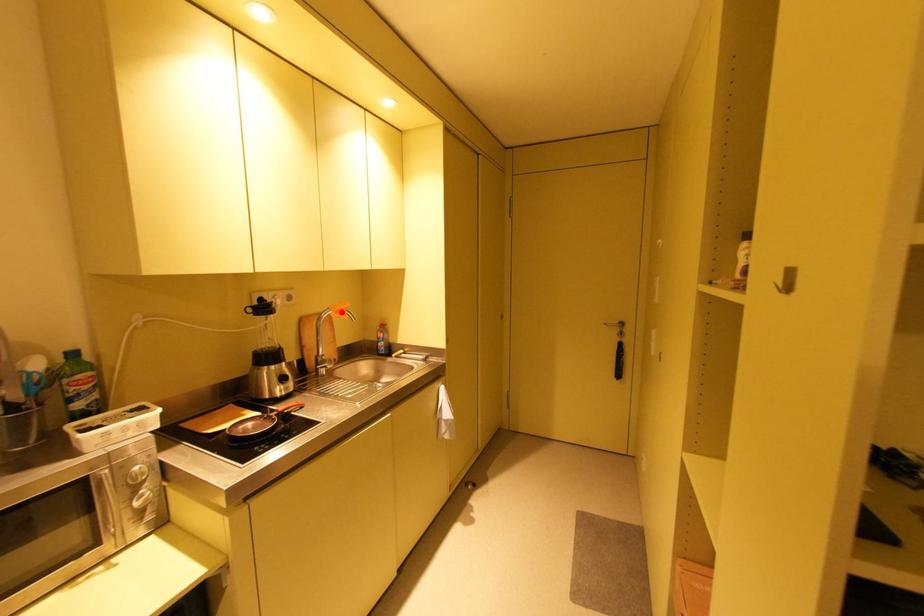
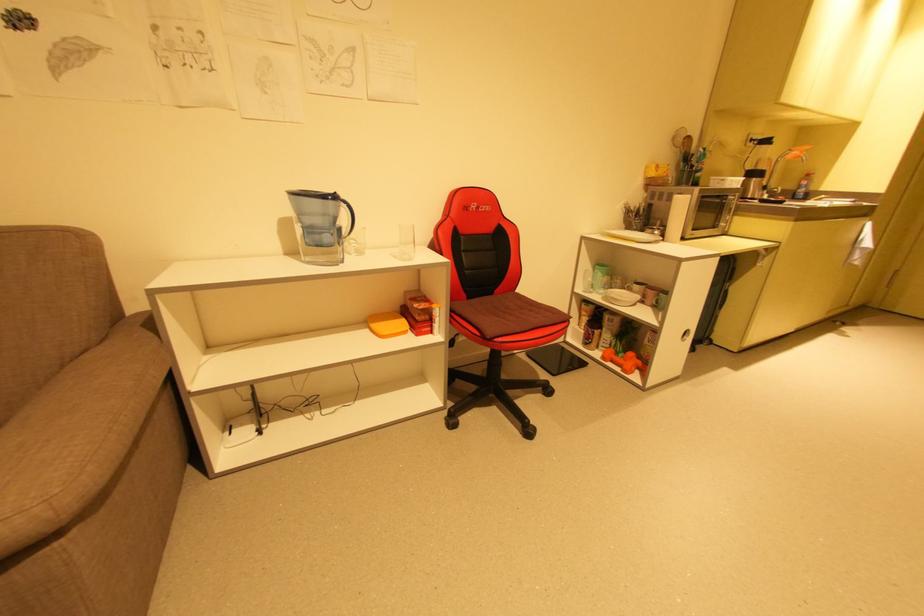
Question: I am providing you with two images of the same scene from different viewpoints. Given a red point in image1, look at the same physical point in image2. Is it:

Choices:
 (A) Closer to the viewpoint
 (B) Farther from the viewpoint

Answer: (B)